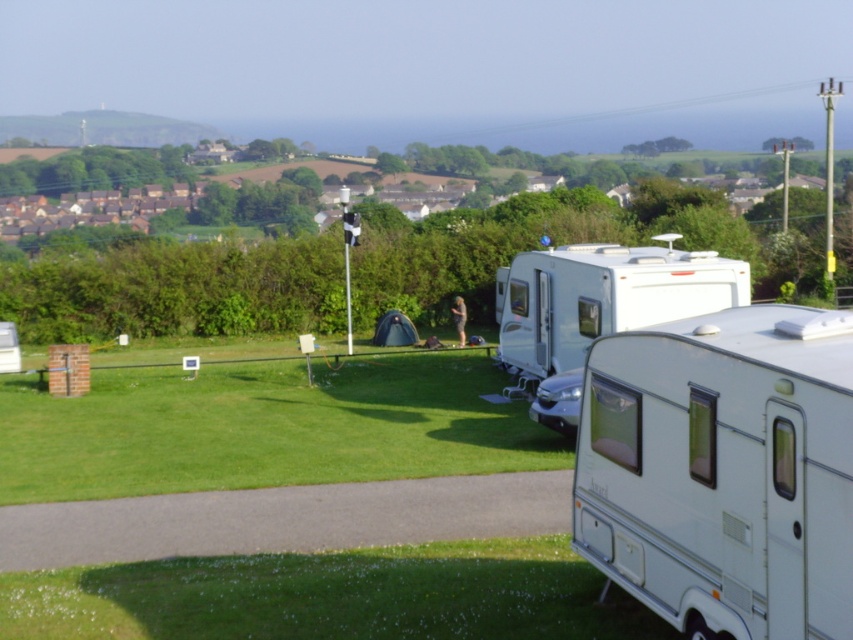
Question: Can you confirm if white glossy camper at center is positioned above white glossy caravan at center?

Choices:
 (A) yes
 (B) no

Answer: (B)

Question: Which of the following is the closest to the observer?

Choices:
 (A) white glossy caravan at center
 (B) white glossy camper at center

Answer: (B)

Question: Considering the relative positions of white glossy camper at center and white glossy caravan at center in the image provided, where is white glossy camper at center located with respect to white glossy caravan at center?

Choices:
 (A) below
 (B) above

Answer: (A)

Question: Is white glossy camper at center to the left of white glossy caravan at center from the viewer's perspective?

Choices:
 (A) yes
 (B) no

Answer: (A)